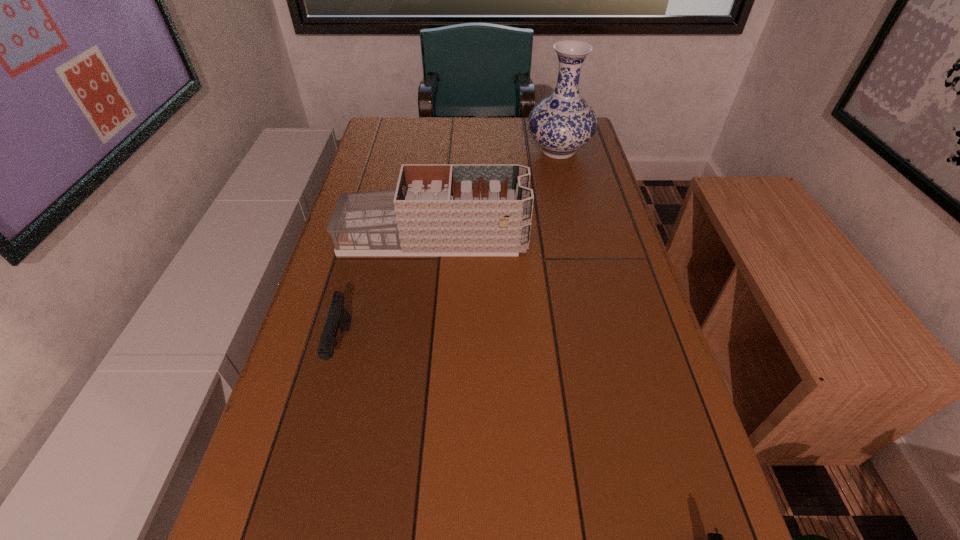
Identify the location of dollhouse located at the left edge. click(437, 209).

You are a GUI agent. You are given a task and a screenshot of the screen. Output one action in this format:
    pyautogui.click(x=<x>, y=<y>)
    Task: Click on the pistol present at the left edge
    The image size is (960, 540).
    Given the screenshot: What is the action you would take?
    pyautogui.click(x=338, y=316)

Image resolution: width=960 pixels, height=540 pixels. I want to click on object present at the right edge, so click(x=563, y=122).

Where is `object located at the far right corner`? Image resolution: width=960 pixels, height=540 pixels. object located at the far right corner is located at coordinates (563, 122).

The width and height of the screenshot is (960, 540). In order to click on blank space at the far edge of the desktop in this screenshot , I will do `click(460, 146)`.

The image size is (960, 540). I want to click on vacant area at the left edge, so click(306, 323).

Where is `free region at the right edge`? free region at the right edge is located at coordinates pyautogui.click(x=649, y=300).

Locate an element on the screen. vacant area at the far left corner is located at coordinates (377, 138).

Find the location of a particular element. free spot between the taller pistol and the second tallest object is located at coordinates (387, 292).

The height and width of the screenshot is (540, 960). What are the coordinates of `object identified as the closest to the second farthest object` in the screenshot? It's located at (338, 316).